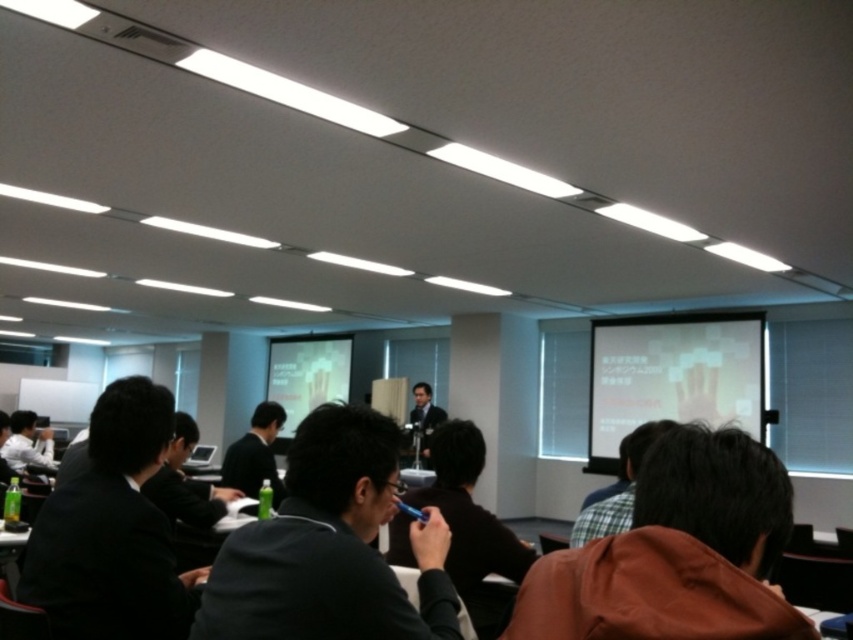
Which of these two, white matte projection screen at upper center or dark gray suit at center, stands shorter?

dark gray suit at center

The width and height of the screenshot is (853, 640). What do you see at coordinates (672, 374) in the screenshot?
I see `white matte projection screen at upper center` at bounding box center [672, 374].

This screenshot has height=640, width=853. What are the coordinates of `white matte projection screen at upper center` in the screenshot? It's located at (672, 374).

Between matte white projector screen at center and dark gray suit at center, which one appears on the right side from the viewer's perspective?

Positioned to the right is dark gray suit at center.

Is matte white projector screen at center positioned before dark gray suit at center?

No, it is behind dark gray suit at center.

Locate an element on the screen. matte white projector screen at center is located at coordinates (306, 374).

Is dark gray suit at center closer to the viewer compared to white shirt at left?

Yes, it is.

Who is more distant from viewer, (251,456) or (45,452)?

Point (45,452)

This screenshot has height=640, width=853. Find the location of `dark gray suit at center`. dark gray suit at center is located at coordinates (254, 454).

The width and height of the screenshot is (853, 640). What are the coordinates of `dark gray suit at center` in the screenshot? It's located at (254, 454).